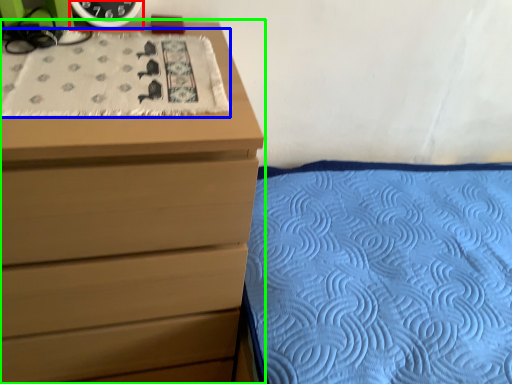
Question: Considering the real-world distances, which object is farthest from clock (highlighted by a red box)? blanket (highlighted by a blue box) or chest of drawers (highlighted by a green box)?

Choices:
 (A) blanket
 (B) chest of drawers

Answer: (B)